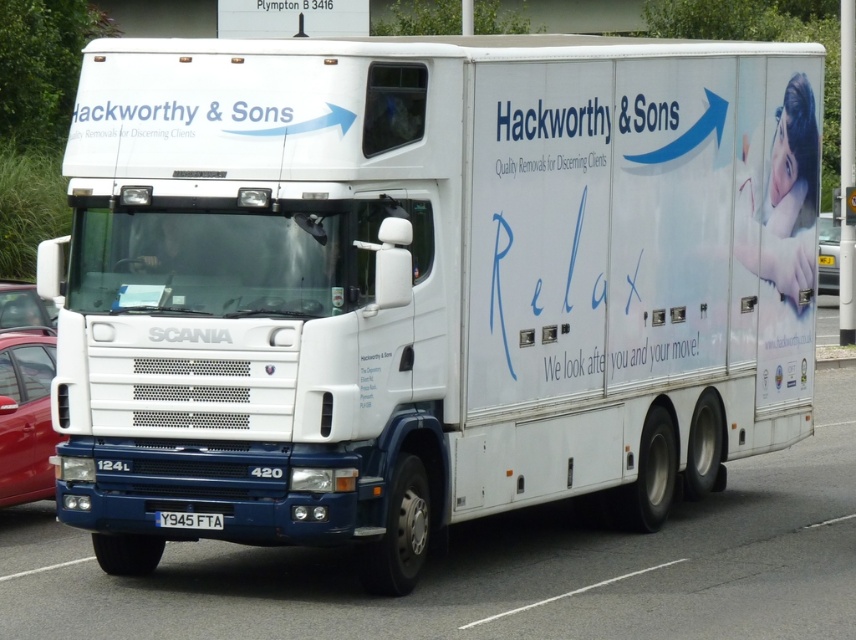
Does white glossy truck at center have a greater width compared to white plastic license plate at center?

Correct, the width of white glossy truck at center exceeds that of white plastic license plate at center.

Looking at this image, does white glossy truck at center appear over white plastic license plate at center?

No.

Between point (223, 596) and point (191, 518), which one is positioned in front?

Point (191, 518) is more forward.

Locate an element on the screen. This screenshot has height=640, width=856. white glossy truck at center is located at coordinates click(494, 568).

Which is more to the right, metallic red car at left or metallic silver car at left?

metallic red car at left

Does point (45, 365) come farther from viewer compared to point (7, 300)?

No, it is not.

Where is `metallic red car at left`? This screenshot has height=640, width=856. metallic red car at left is located at coordinates (25, 417).

Who is taller, metallic silver car at left or white plastic license plate at center?

metallic silver car at left

This screenshot has width=856, height=640. In order to click on metallic silver car at left in this screenshot , I will do `click(24, 308)`.

This screenshot has width=856, height=640. Identify the location of metallic silver car at left. click(x=24, y=308).

Identify the location of metallic silver car at left. (24, 308).